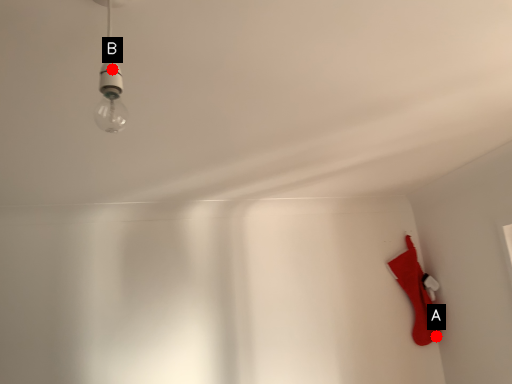
Question: Two points are circled on the image, labeled by A and B beside each circle. Which point appears closest to the camera in this image?

Choices:
 (A) A is closer
 (B) B is closer

Answer: (B)